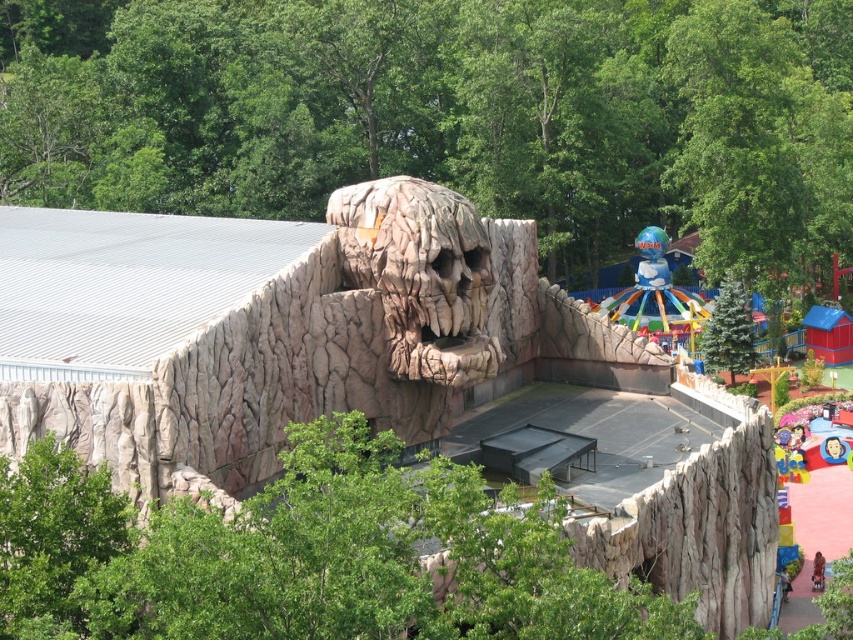
Who is shorter, rough stone skull at center or multicolored plastic carousel at center?

rough stone skull at center is shorter.

Is rough stone skull at center above multicolored plastic carousel at center?

Actually, rough stone skull at center is below multicolored plastic carousel at center.

Does point (351, 272) lie in front of point (614, 312)?

Yes, it is in front of point (614, 312).

At what (x,y) coordinates should I click in order to perform the action: click on rough stone skull at center. Please return your answer as a coordinate pair (x, y). Image resolution: width=853 pixels, height=640 pixels. Looking at the image, I should click on coord(421,275).

Can you confirm if rough stone skull at center is thinner than green textured pine tree at center right?

In fact, rough stone skull at center might be wider than green textured pine tree at center right.

How far apart are rough stone skull at center and green textured pine tree at center right?

rough stone skull at center and green textured pine tree at center right are 43.44 meters apart.

Between point (401, 284) and point (749, 310), which one is positioned behind?

The point (749, 310) is behind.

The width and height of the screenshot is (853, 640). What are the coordinates of `rough stone skull at center` in the screenshot? It's located at (421, 275).

Is point (656, 320) farther from viewer compared to point (735, 362)?

Yes, it is.

Is multicolored plastic carousel at center thinner than green textured pine tree at center right?

No.

The image size is (853, 640). What are the coordinates of `multicolored plastic carousel at center` in the screenshot? It's located at (654, 292).